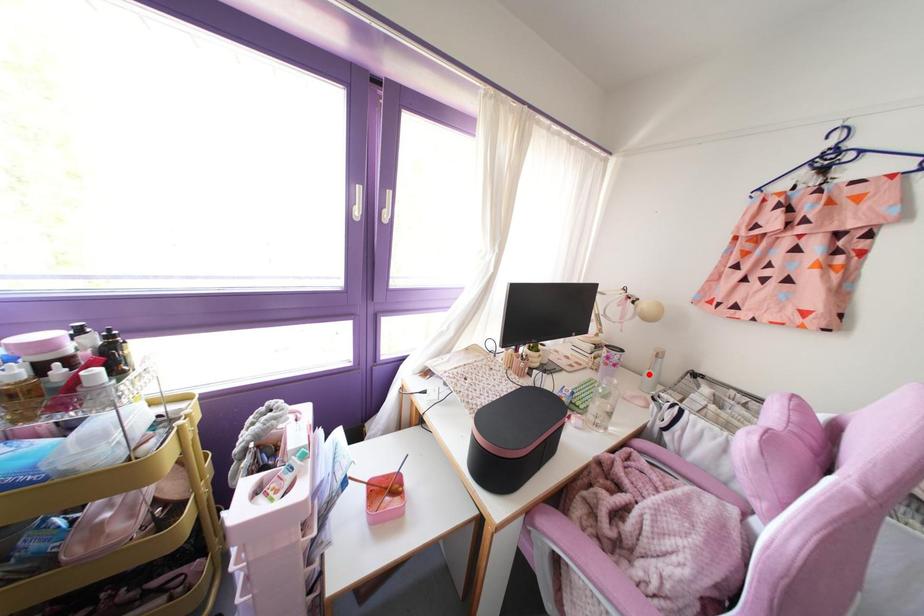
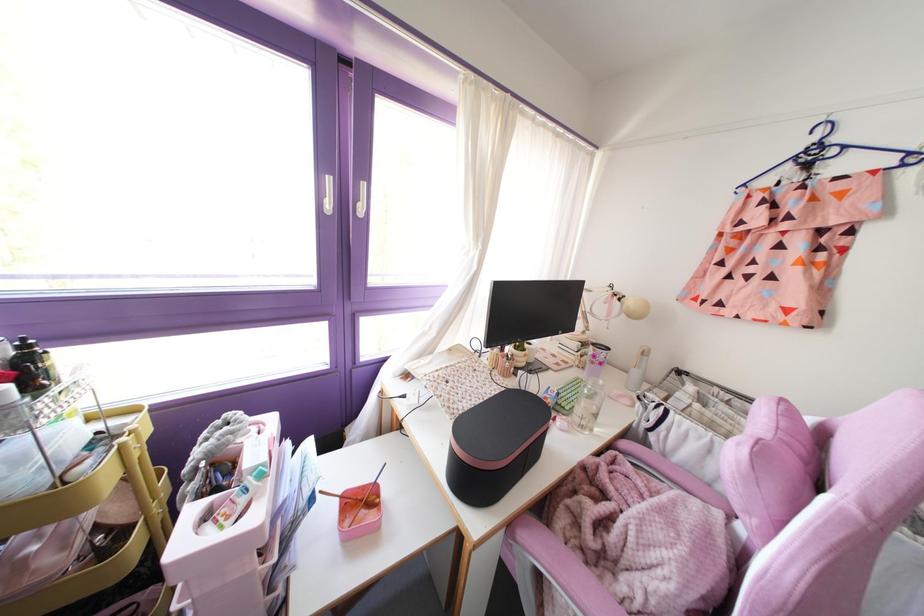
Find the pixel in the second image that matches the highlighted location in the first image.

(634, 371)